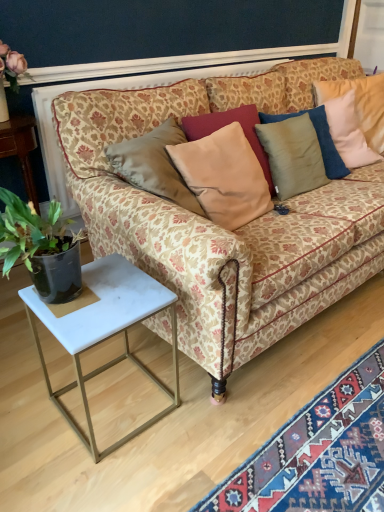
Find the location of `free space that is to the left of white marble side table at lower left`. free space that is to the left of white marble side table at lower left is located at coordinates (33, 395).